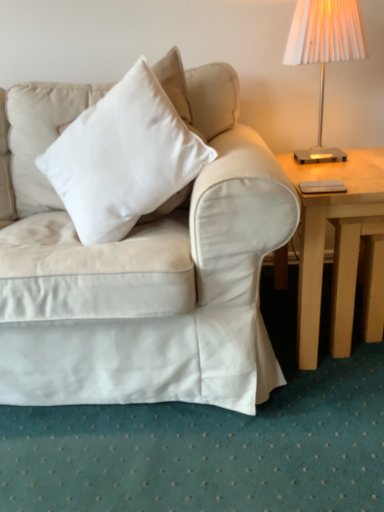
Find the location of a particular element. The width and height of the screenshot is (384, 512). vacant space situated above light wood table at right (from a real-world perspective) is located at coordinates (347, 163).